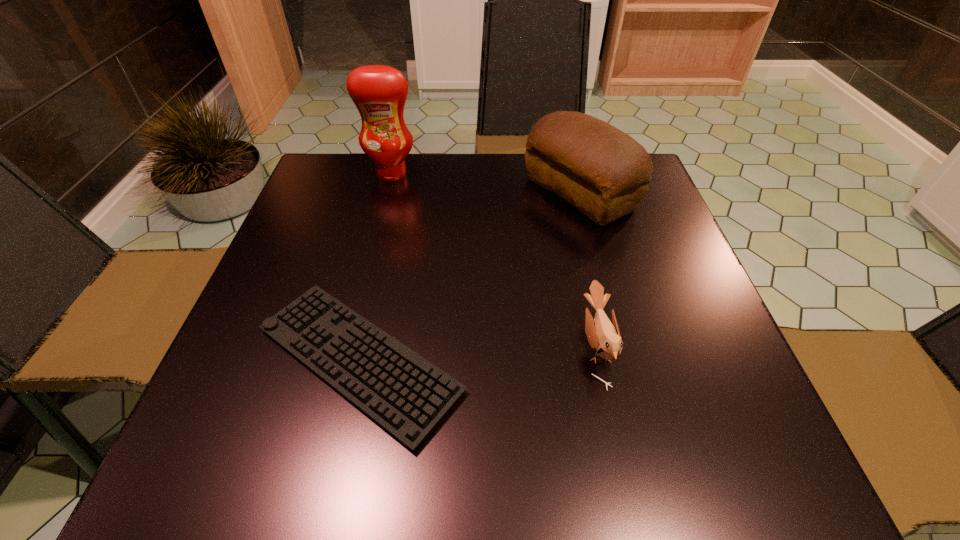
Where is `free space at the near edge`? This screenshot has width=960, height=540. free space at the near edge is located at coordinates (307, 462).

You are a GUI agent. You are given a task and a screenshot of the screen. Output one action in this format:
    pyautogui.click(x=<x>, y=<y>)
    Task: Click on the vacant space at the right edge of the desktop
    This screenshot has width=960, height=540.
    Given the screenshot: What is the action you would take?
    pyautogui.click(x=708, y=408)

Image resolution: width=960 pixels, height=540 pixels. I want to click on free space at the far left corner of the desktop, so click(x=350, y=154).

Identify the location of free space between the computer keyboard and the bird. The height and width of the screenshot is (540, 960). (478, 353).

The image size is (960, 540). I want to click on unoccupied position between the computer keyboard and the second shortest object, so [x=478, y=353].

You are a GUI agent. You are given a task and a screenshot of the screen. Output one action in this format:
    pyautogui.click(x=<x>, y=<y>)
    Task: Click on the free space between the tallest object and the bread
    This screenshot has height=540, width=960.
    Given the screenshot: What is the action you would take?
    pyautogui.click(x=486, y=183)

At what (x,y) coordinates should I click in order to perform the action: click on free space that is in between the bread and the bird. Please return your answer as a coordinate pair (x, y). The width and height of the screenshot is (960, 540). Looking at the image, I should click on (588, 269).

This screenshot has width=960, height=540. What are the coordinates of `vacant area that lies between the bird and the tallest object` in the screenshot? It's located at (494, 259).

Identify the location of free space between the bread and the bird. (588, 269).

I want to click on free area in between the second tallest object and the computer keyboard, so click(x=469, y=277).